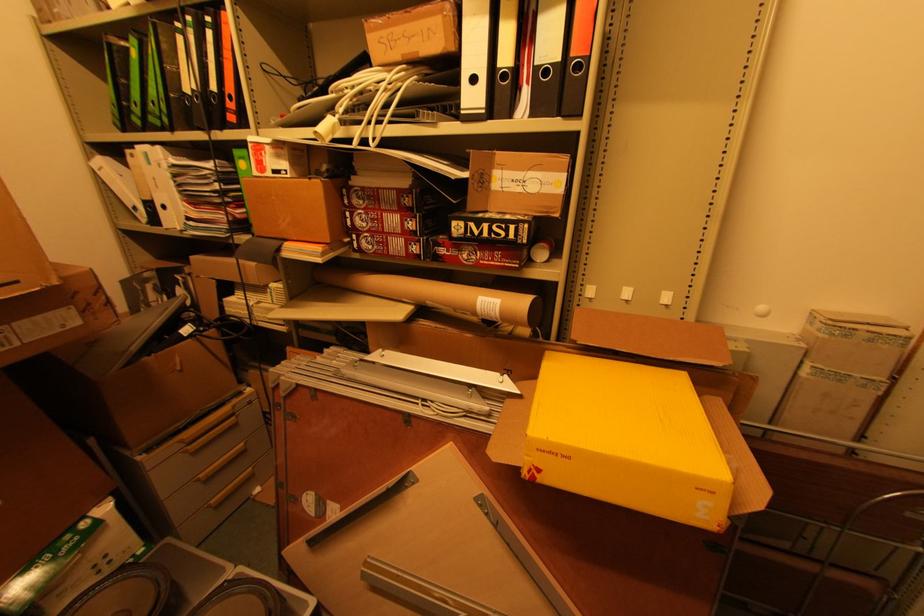
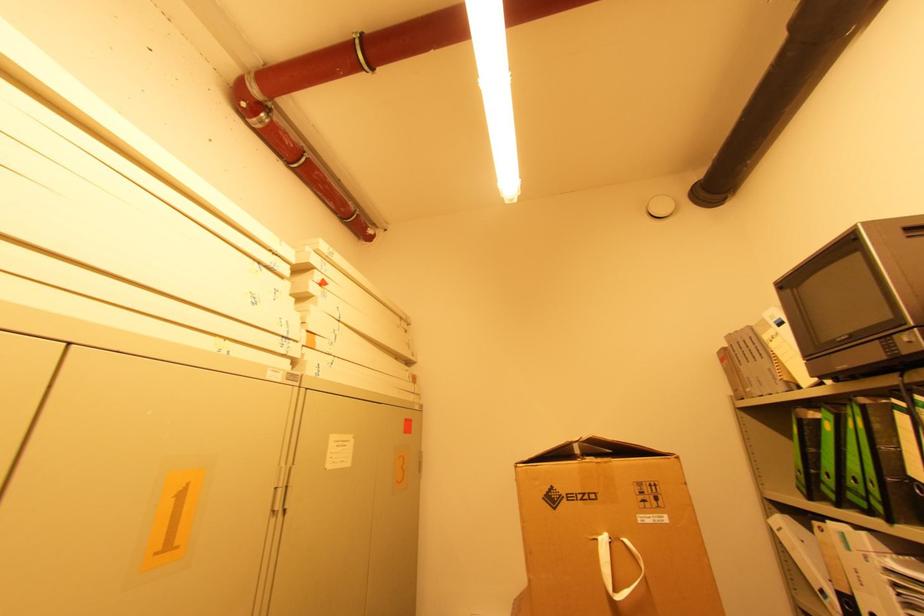
The point at (131, 107) is marked in the first image. Where is the corresponding point in the second image?

(822, 476)